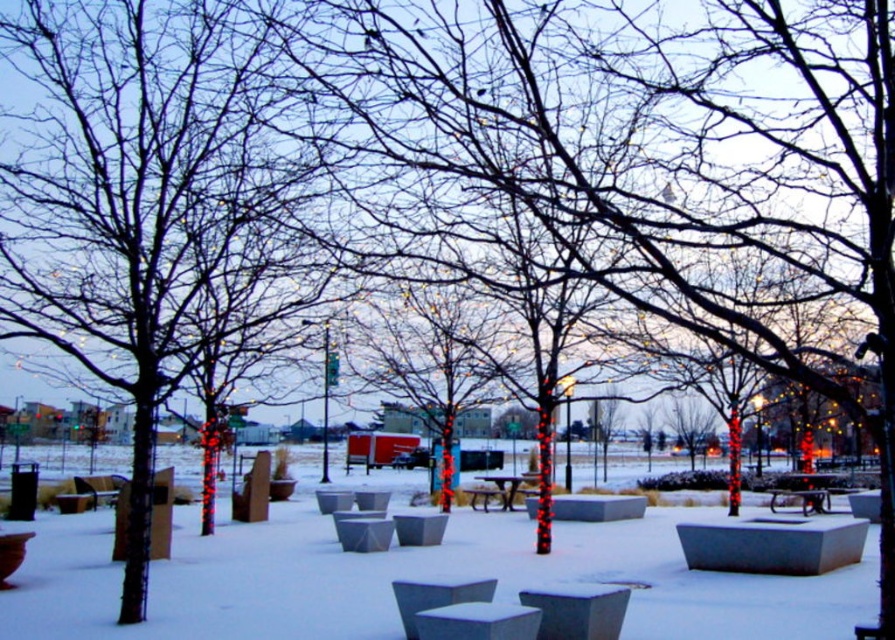
I want to click on smooth bark tree at center, so click(x=133, y=198).

Measure the distance between smooth bark tree at center and camera.

They are 5.67 meters apart.

Which is in front, point (53, 61) or point (496, 531)?

Positioned in front is point (53, 61).

The width and height of the screenshot is (895, 640). What are the coordinates of `smooth bark tree at center` in the screenshot? It's located at (133, 198).

Between metallic silver bench at center and metallic silver picnic table at center, which one has more height?

metallic silver picnic table at center is taller.

Does metallic silver bench at center appear under metallic silver picnic table at center?

Actually, metallic silver bench at center is above metallic silver picnic table at center.

This screenshot has height=640, width=895. Describe the element at coordinates (800, 499) in the screenshot. I see `metallic silver bench at center` at that location.

In order to click on metallic silver bench at center in this screenshot , I will do `click(800, 499)`.

In the scene shown: Who is higher up, smooth bark tree at center or metallic silver bench at center?

smooth bark tree at center is above.

Describe the element at coordinates (133, 198) in the screenshot. I see `smooth bark tree at center` at that location.

Image resolution: width=895 pixels, height=640 pixels. Describe the element at coordinates (133, 198) in the screenshot. I see `smooth bark tree at center` at that location.

I want to click on smooth bark tree at center, so click(133, 198).